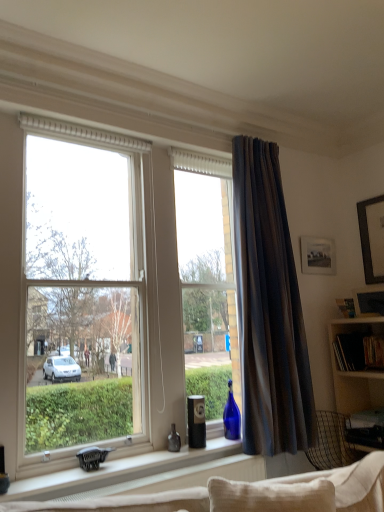
Where is `vacant space to the right of matte glass bottle at window sill`? The height and width of the screenshot is (512, 384). vacant space to the right of matte glass bottle at window sill is located at coordinates (188, 449).